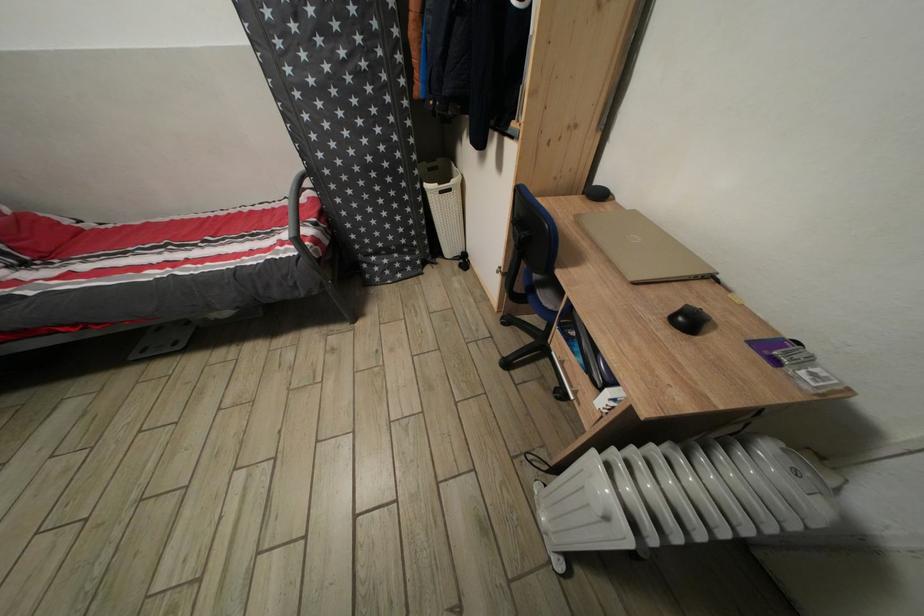
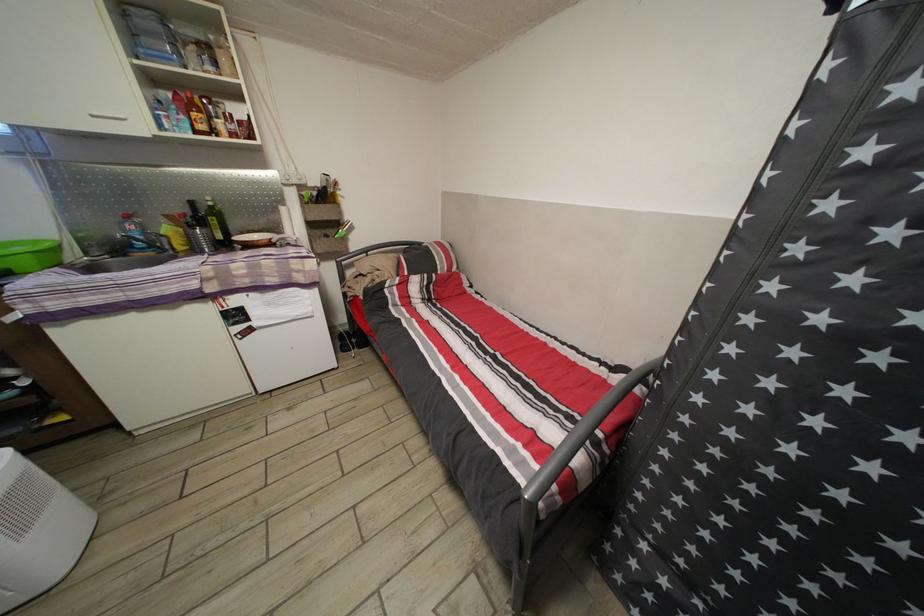
Question: The camera is either moving clockwise (left) or counter-clockwise (right) around the object. The first image is from the beginning of the video and the second image is from the end. Is the camera moving left or right when shooting the video?

Choices:
 (A) Left
 (B) Right

Answer: (B)